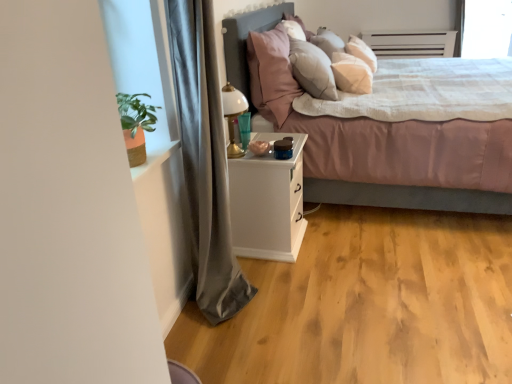
Question: Is the depth of transparent glass window screen at upper right less than that of gold metallic table lamp at center?

Choices:
 (A) no
 (B) yes

Answer: (A)

Question: Considering the relative positions of transparent glass window screen at upper right and gold metallic table lamp at center in the image provided, is transparent glass window screen at upper right to the left of gold metallic table lamp at center from the viewer's perspective?

Choices:
 (A) yes
 (B) no

Answer: (B)

Question: Considering the relative sizes of transparent glass window screen at upper right and gold metallic table lamp at center in the image provided, is transparent glass window screen at upper right shorter than gold metallic table lamp at center?

Choices:
 (A) no
 (B) yes

Answer: (A)

Question: Is transparent glass window screen at upper right completely or partially outside of gold metallic table lamp at center?

Choices:
 (A) yes
 (B) no

Answer: (A)

Question: Is transparent glass window screen at upper right far away from gold metallic table lamp at center?

Choices:
 (A) no
 (B) yes

Answer: (B)

Question: Is transparent glass window screen at upper right turned away from gold metallic table lamp at center?

Choices:
 (A) yes
 (B) no

Answer: (B)

Question: Does gold metallic table lamp at center have a greater width compared to gray fabric curtain at left?

Choices:
 (A) no
 (B) yes

Answer: (A)

Question: Does gold metallic table lamp at center come behind gray fabric curtain at left?

Choices:
 (A) yes
 (B) no

Answer: (A)

Question: Would you say gold metallic table lamp at center is outside gray fabric curtain at left?

Choices:
 (A) yes
 (B) no

Answer: (A)

Question: Does gold metallic table lamp at center appear on the left side of gray fabric curtain at left?

Choices:
 (A) no
 (B) yes

Answer: (A)

Question: Is gold metallic table lamp at center to the right of gray fabric curtain at left from the viewer's perspective?

Choices:
 (A) no
 (B) yes

Answer: (B)

Question: Is gold metallic table lamp at center oriented towards gray fabric curtain at left?

Choices:
 (A) yes
 (B) no

Answer: (B)

Question: Considering the relative sizes of white matte nightstand at center and transparent glass window screen at upper right in the image provided, is white matte nightstand at center taller than transparent glass window screen at upper right?

Choices:
 (A) no
 (B) yes

Answer: (A)